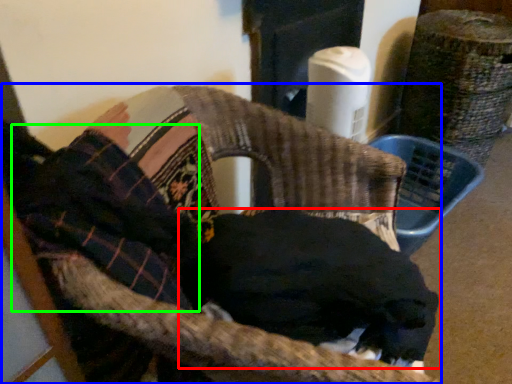
Question: Estimate the real-world distances between objects in this image. Which object is closer to dog (highlighted by a red box), chair (highlighted by a blue box) or clothing (highlighted by a green box)?

Choices:
 (A) chair
 (B) clothing

Answer: (A)